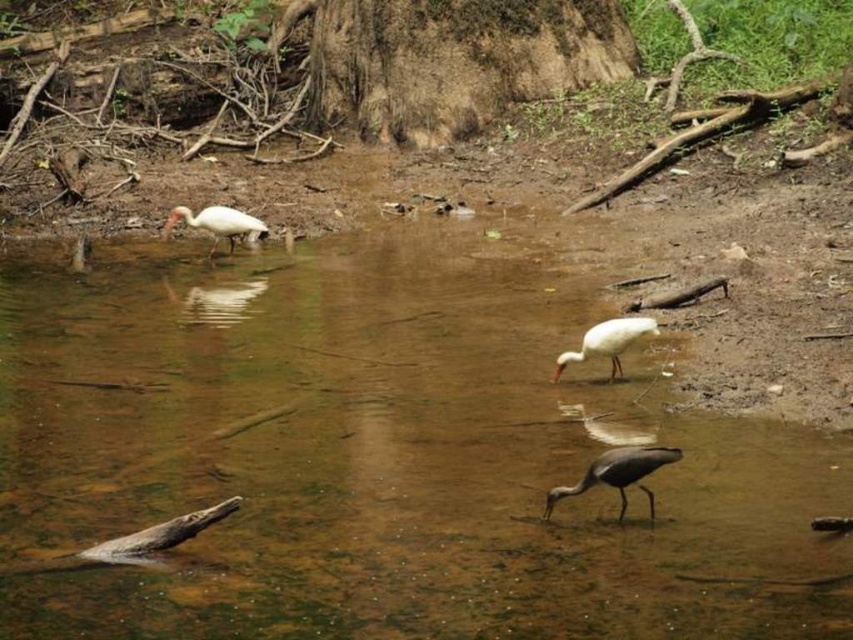
Question: Is white matte bird at center in front of white glossy bird at upper left?

Choices:
 (A) no
 (B) yes

Answer: (B)

Question: Estimate the real-world distances between objects in this image. Which object is farther from the gray matte bird at lower center?

Choices:
 (A) white glossy bird at upper left
 (B) brown murky water at center

Answer: (A)

Question: Can you confirm if brown murky water at center is positioned below gray matte bird at lower center?

Choices:
 (A) yes
 (B) no

Answer: (B)

Question: Which point is farther to the camera?

Choices:
 (A) (622, 492)
 (B) (621, 323)
 (C) (381, 460)
 (D) (213, 236)

Answer: (D)

Question: Which object appears farthest from the camera in this image?

Choices:
 (A) brown murky water at center
 (B) white glossy bird at upper left
 (C) gray matte bird at lower center

Answer: (B)

Question: Observing the image, what is the correct spatial positioning of brown murky water at center in reference to white matte bird at center?

Choices:
 (A) above
 (B) below

Answer: (B)